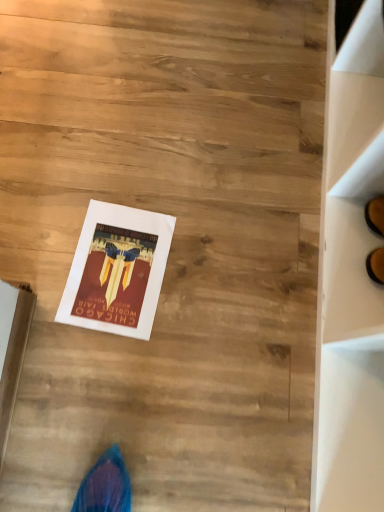
The height and width of the screenshot is (512, 384). I want to click on vacant space behind matte paper poster at center, so click(137, 174).